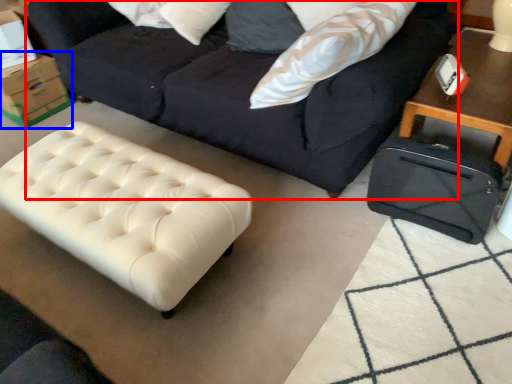
Question: Which point is further to the camera, studio couch (highlighted by a red box) or cardboard box (highlighted by a blue box)?

Choices:
 (A) studio couch
 (B) cardboard box

Answer: (B)